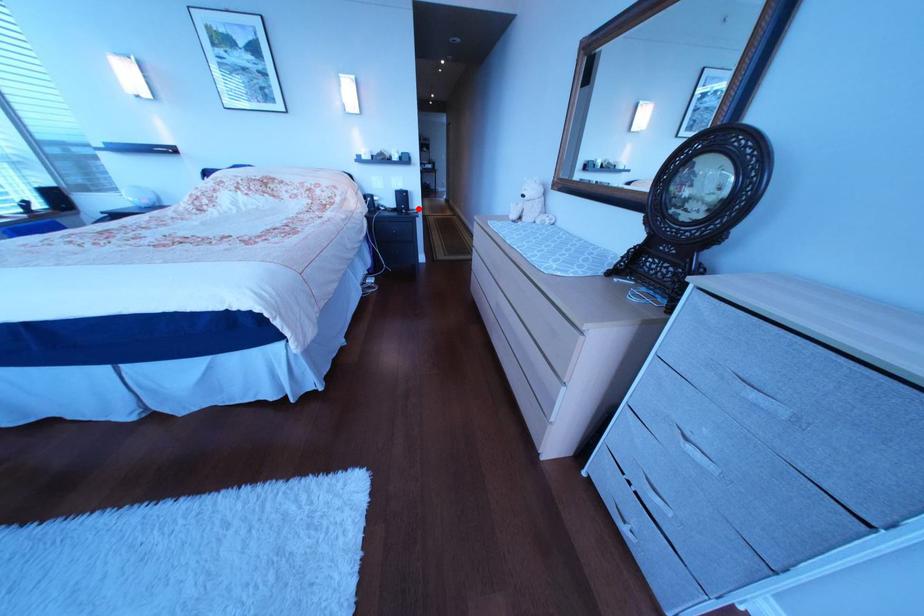
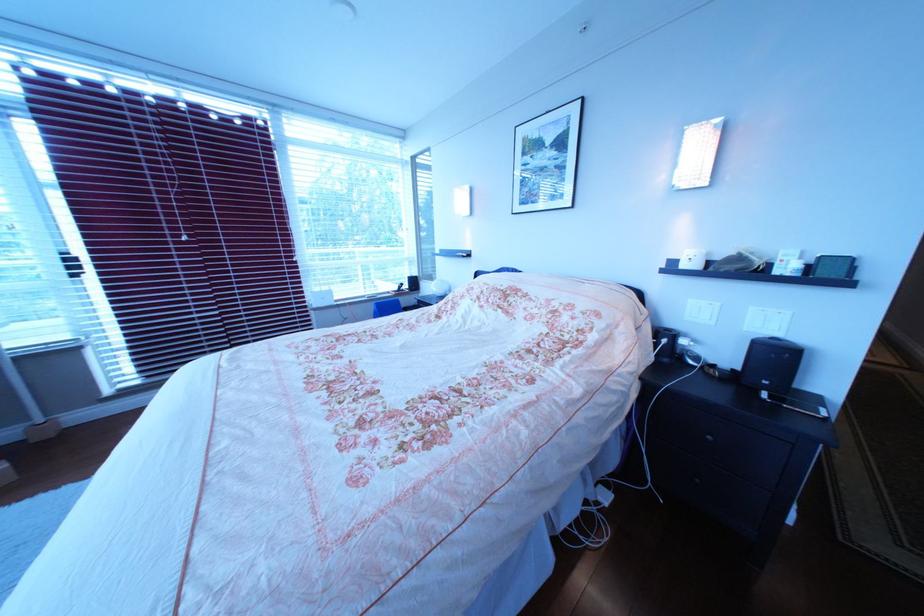
Where in the second image is the point corresponding to the highlighted location from the first image?

(782, 384)